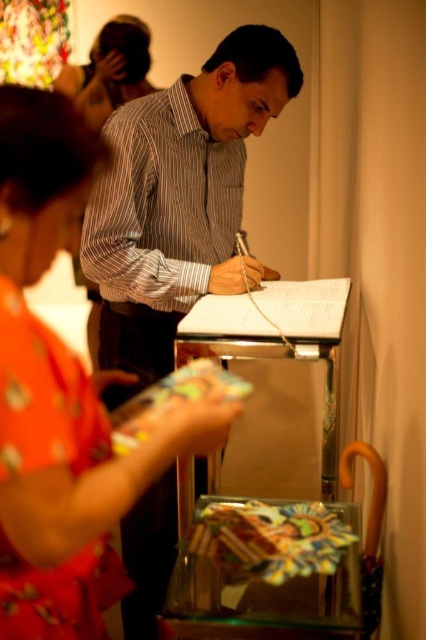
Does floral fabric dress at lower left have a greater height compared to striped shirt at center?

No.

Does floral fabric dress at lower left have a smaller size compared to striped shirt at center?

Indeed, floral fabric dress at lower left has a smaller size compared to striped shirt at center.

Is point (158, 461) less distant than point (224, 138)?

Yes, point (158, 461) is in front of point (224, 138).

Identify the location of floral fabric dress at lower left. (62, 396).

Can you confirm if floral fabric dress at lower left is positioned to the left of matte black hair at upper left?

No, floral fabric dress at lower left is not to the left of matte black hair at upper left.

Is floral fabric dress at lower left thinner than matte black hair at upper left?

Yes.

Between point (88, 582) and point (94, 67), which one is positioned in front?

Point (88, 582) is more forward.

You are a GUI agent. You are given a task and a screenshot of the screen. Output one action in this format:
    pyautogui.click(x=<x>, y=<y>)
    Task: Click on the floral fabric dress at lower left
    
    Given the screenshot: What is the action you would take?
    pyautogui.click(x=62, y=396)

Looking at this image, which is more to the left, floral fabric dress at lower left or striped cotton shirt at center?

floral fabric dress at lower left is more to the left.

Does point (28, 500) come farther from viewer compared to point (124, 164)?

No, it is not.

Is point (106, 490) positioned in front of point (184, 253)?

Yes, point (106, 490) is in front of point (184, 253).

Find the location of a particular element. This screenshot has width=426, height=640. floral fabric dress at lower left is located at coordinates (62, 396).